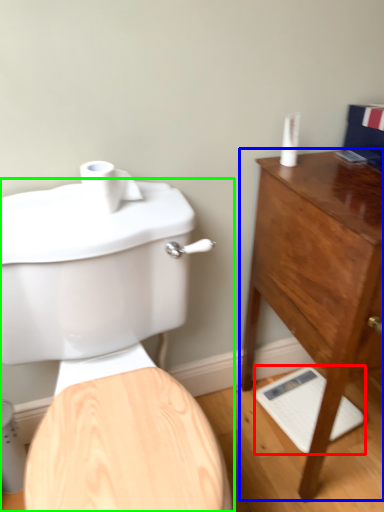
Question: Which object is the closest to the porcelain (highlighted by a red box)? Choose among these: chest of drawers (highlighted by a blue box) or toilet (highlighted by a green box).

Choices:
 (A) chest of drawers
 (B) toilet

Answer: (A)